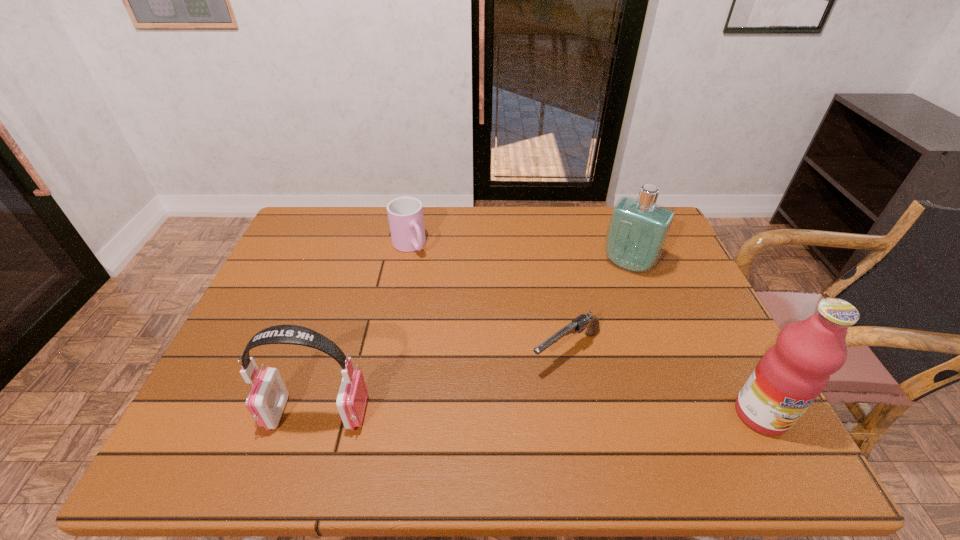
Identify the location of vacant space on the desktop that is between the earphone and the rightmost object and is positioned with the handle on the side of the cup. The image size is (960, 540). (540, 414).

Identify the location of free space on the desktop that is between the earphone and the rightmost object and is positioned on the front label of the perfume. Image resolution: width=960 pixels, height=540 pixels. (539, 414).

The image size is (960, 540). Find the location of `vacant space on the desktop that is between the earphone and the fruit juice and is positioned aiming along the barrel of the gun`. vacant space on the desktop that is between the earphone and the fruit juice and is positioned aiming along the barrel of the gun is located at coordinates (483, 413).